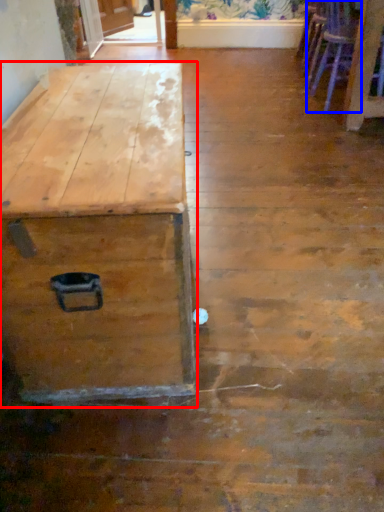
Question: Which object is further to the camera taking this photo, table (highlighted by a red box) or armchair (highlighted by a blue box)?

Choices:
 (A) table
 (B) armchair

Answer: (B)